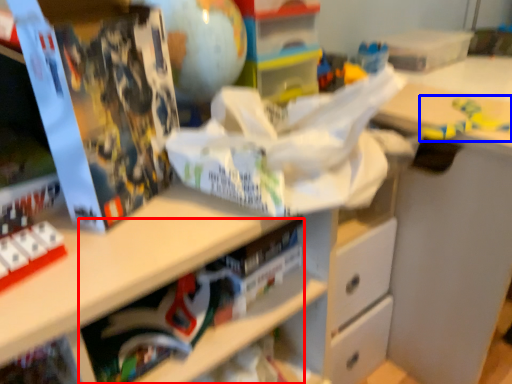
Question: Among these objects, which one is nearest to the camera, book (highlighted by a red box) or toy (highlighted by a blue box)?

Choices:
 (A) book
 (B) toy

Answer: (A)